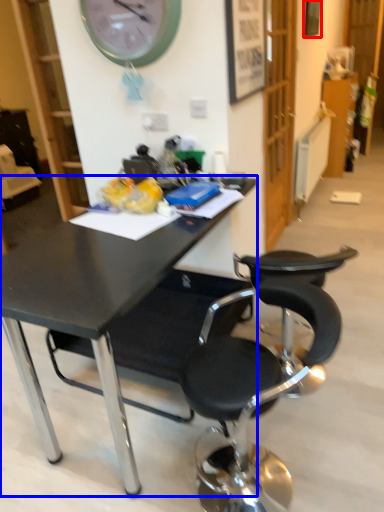
Question: Which point is closer to the camera, picture frame (highlighted by a red box) or desk (highlighted by a blue box)?

Choices:
 (A) picture frame
 (B) desk

Answer: (B)